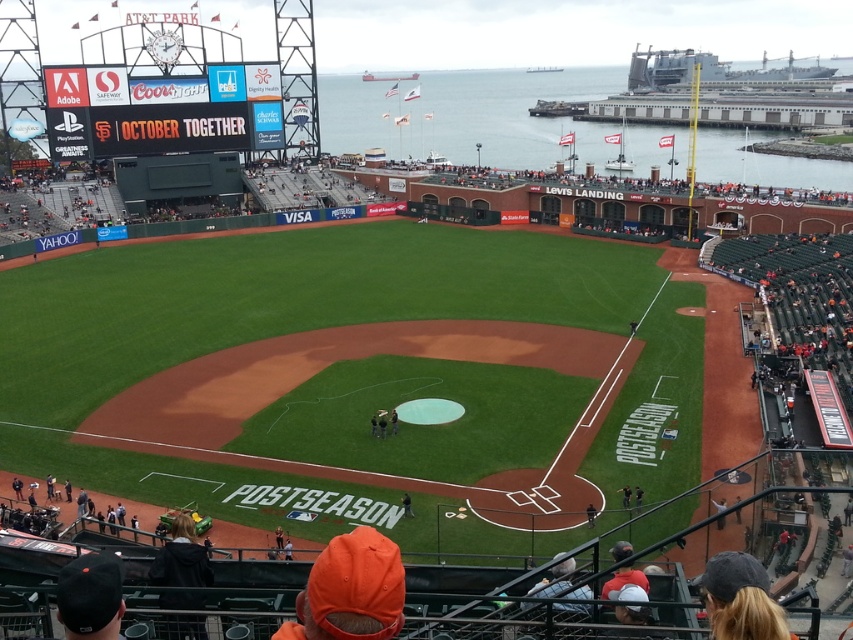
You are a photographer positioned at the upper deck of AT T Park. You want to capture a photo of both the orange fabric cap at lower center and the black uniform at center. Which object will appear narrower in your photo?

The orange fabric cap at lower center will appear narrower in the photo because it is thinner than the black uniform at center.

You are standing at the center of the field and looking towards the stands. Which direction should you turn to face the orange fabric cap at lower center?

The orange fabric cap at lower center is located at point coordinates, so you should turn to the lower center direction to face it.